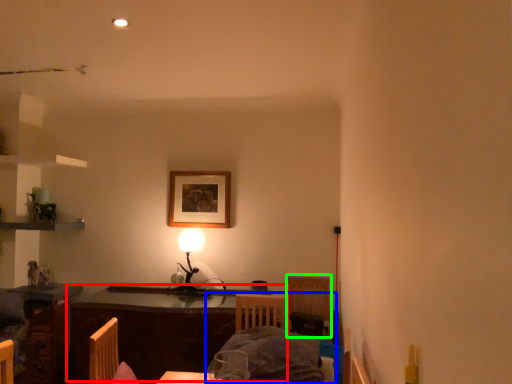
Question: Which is farther away from table (highlighted by a red box)? bed (highlighted by a blue box) or armchair (highlighted by a green box)?

Choices:
 (A) bed
 (B) armchair

Answer: (B)